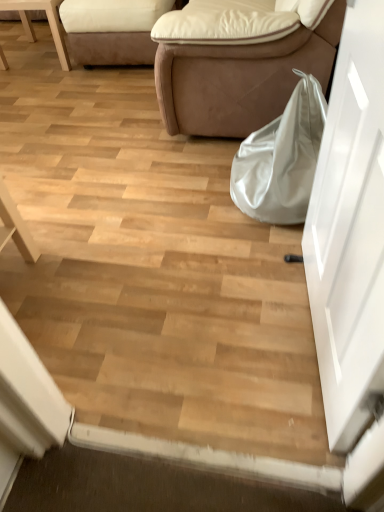
Question: Based on their sizes in the image, would you say suede beige studio couch at upper left, the first studio couch in the left-to-right sequence, is bigger or smaller than brown leather couch at center, which is the first studio couch in right-to-left order?

Choices:
 (A) small
 (B) big

Answer: (A)

Question: Looking at their shapes, would you say suede beige studio couch at upper left, the first studio couch in the left-to-right sequence, is wider or thinner than brown leather couch at center, the 2th studio couch positioned from the left?

Choices:
 (A) wide
 (B) thin

Answer: (B)

Question: Considering the real-world distances, which object is farthest from the white glossy door at right?

Choices:
 (A) satin white bag at lower right
 (B) white leather chair at upper left
 (C) brown leather couch at center, the 2th studio couch positioned from the left
 (D) suede beige studio couch at upper left, the first studio couch in the left-to-right sequence

Answer: (B)

Question: Based on their relative distances, which object is farther from the brown leather couch at center, which is the first studio couch in right-to-left order?

Choices:
 (A) suede beige studio couch at upper left, the first studio couch in the left-to-right sequence
 (B) satin white bag at lower right
 (C) white leather chair at upper left
 (D) white glossy door at right

Answer: (C)